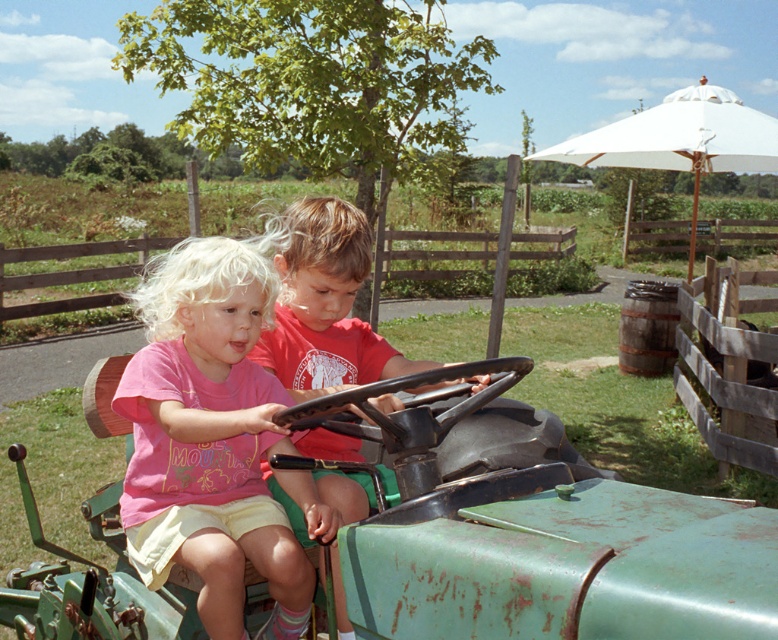
You are a photographer trying to capture a photo of the rusty green tractor at center and the matte red shirt at center. You want to ensure both are visible in your frame. Based on their positions, which object should you focus on first to include both in the shot?

The rusty green tractor at center is to the left of the matte red shirt at center, so you should focus on the matte red shirt at center first to ensure both are in frame.

You are standing at the camera position and want to pick up an object located at point (177, 412). If your arm can reach up to 2 meters, can you reach it?

The distance between you and the point (177, 412) is 1.94 meters, so yes, your arm can reach it since it is within the 2 meters limit.

You are a delivery drone trying to land on the rusty green tractor at center. The landing coordinates are set to point [534,529]. Will the drone land on the correct spot?

Yes, the rusty green tractor at center is located at point [534,529], so the drone will land on the correct spot.